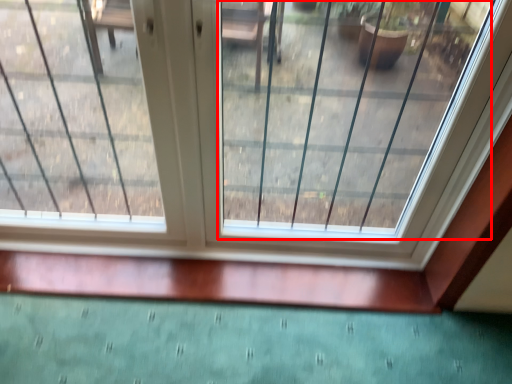
Question: Considering the relative positions of glass window (annotated by the red box) and window in the image provided, where is glass window (annotated by the red box) located with respect to the staircase?

Choices:
 (A) right
 (B) left

Answer: (A)